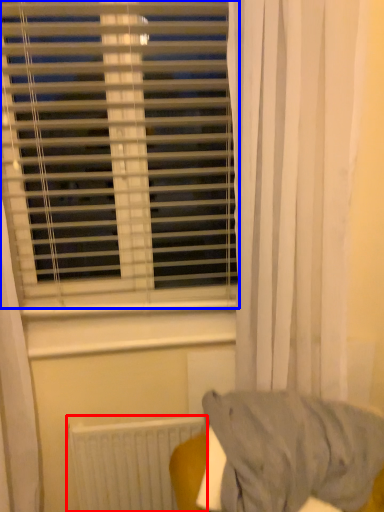
Question: Which object appears farthest to the camera in this image, radiator (highlighted by a red box) or window blind (highlighted by a blue box)?

Choices:
 (A) radiator
 (B) window blind

Answer: (A)